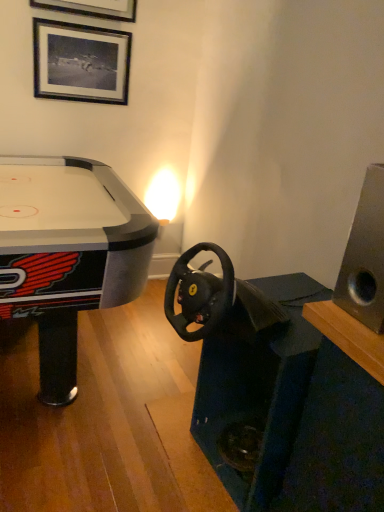
Question: Considering the positions of black matte picture frame at upper left and silver metallic speaker at right in the image, is black matte picture frame at upper left wider or thinner than silver metallic speaker at right?

Choices:
 (A) wide
 (B) thin

Answer: (B)

Question: From the image's perspective, is black matte picture frame at upper left positioned above or below silver metallic speaker at right?

Choices:
 (A) below
 (B) above

Answer: (B)

Question: From their relative heights in the image, would you say black matte picture frame at upper left is taller or shorter than silver metallic speaker at right?

Choices:
 (A) short
 (B) tall

Answer: (A)

Question: Is silver metallic speaker at right inside or outside of black matte picture frame at upper left?

Choices:
 (A) inside
 (B) outside

Answer: (B)

Question: Considering the relative positions of silver metallic speaker at right and black matte picture frame at upper left in the image provided, is silver metallic speaker at right to the left or to the right of black matte picture frame at upper left?

Choices:
 (A) right
 (B) left

Answer: (A)

Question: Looking at the image, does silver metallic speaker at right seem bigger or smaller compared to black matte picture frame at upper left?

Choices:
 (A) big
 (B) small

Answer: (A)

Question: Is silver metallic speaker at right taller or shorter than black matte picture frame at upper left?

Choices:
 (A) tall
 (B) short

Answer: (A)